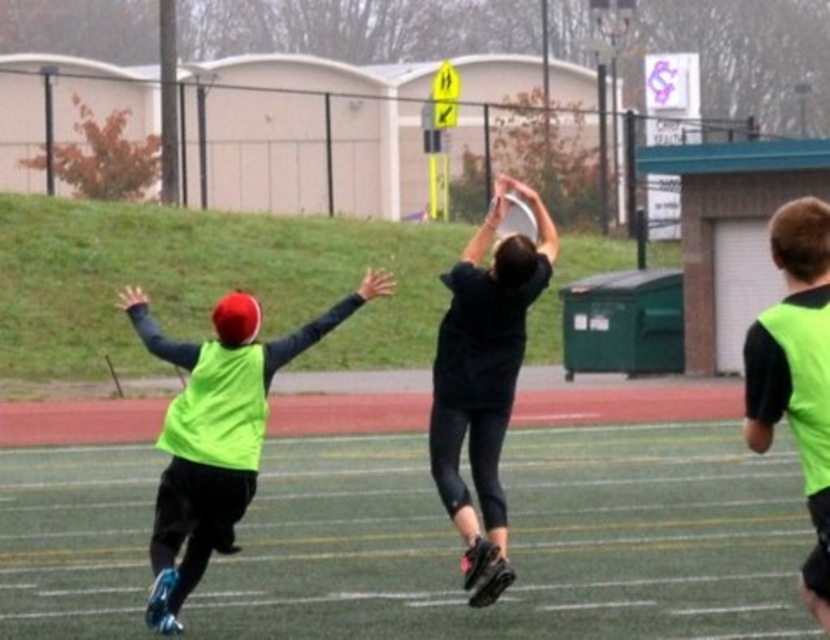
Question: Observing the image, what is the correct spatial positioning of green synthetic turf at center in reference to neon green vest at center?

Choices:
 (A) left
 (B) right

Answer: (B)

Question: In this image, where is black matte jersey at center located relative to neon green vest at right?

Choices:
 (A) below
 (B) above

Answer: (B)

Question: Among these objects, which one is nearest to the camera?

Choices:
 (A) neon green vest at center
 (B) black matte jersey at center
 (C) neon green vest at right

Answer: (C)

Question: Estimate the real-world distances between objects in this image. Which object is farther from the black matte jersey at center?

Choices:
 (A) neon green vest at center
 (B) green synthetic turf at center

Answer: (B)

Question: Does green synthetic turf at center appear under neon green vest at center?

Choices:
 (A) yes
 (B) no

Answer: (A)

Question: Based on their relative distances, which object is farther from the neon green vest at center?

Choices:
 (A) green synthetic turf at center
 (B) neon green vest at right

Answer: (B)